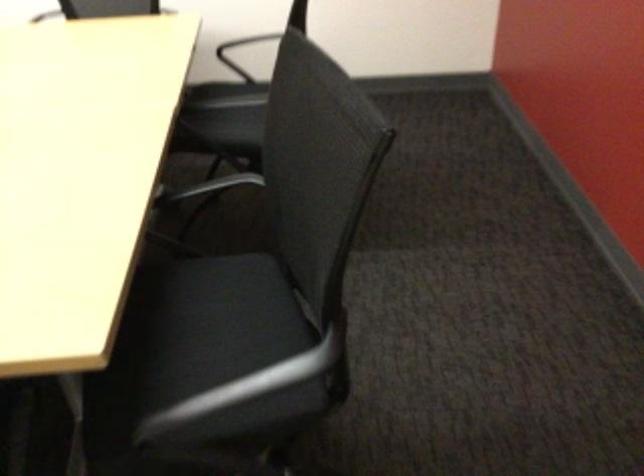
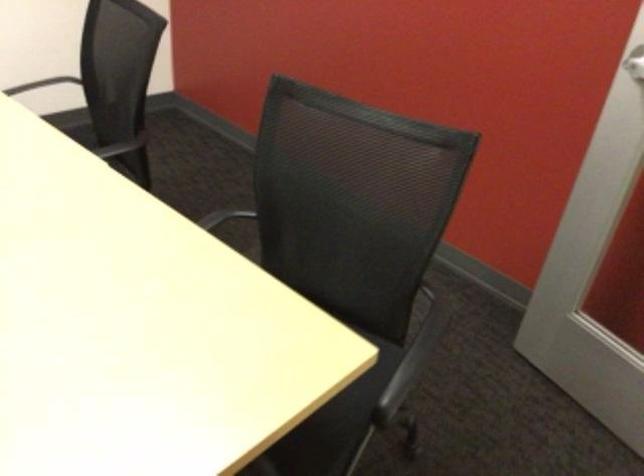
Question: The camera is either moving clockwise (left) or counter-clockwise (right) around the object. The first image is from the beginning of the video and the second image is from the end. Is the camera moving left or right when shooting the video?

Choices:
 (A) Left
 (B) Right

Answer: (A)